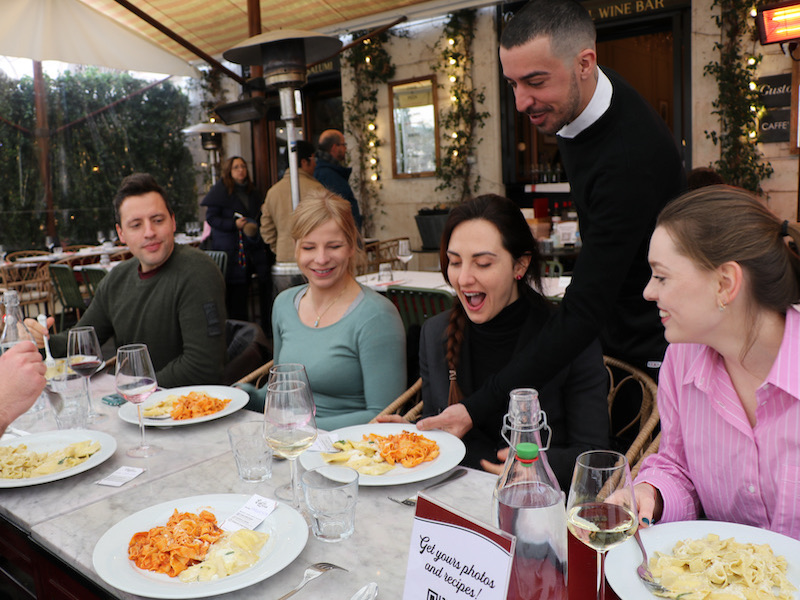
In order to click on silver utensils in this screenshot , I will do `click(58, 397)`, `click(366, 594)`, `click(314, 571)`, `click(410, 503)`, `click(642, 567)`, `click(162, 416)`.